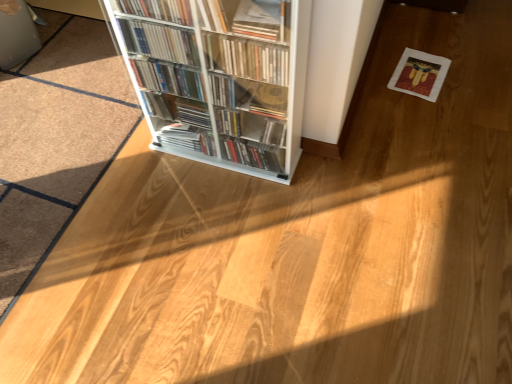
Question: Should I look upward or downward to see white glossy bookcase at center?

Choices:
 (A) up
 (B) down

Answer: (A)